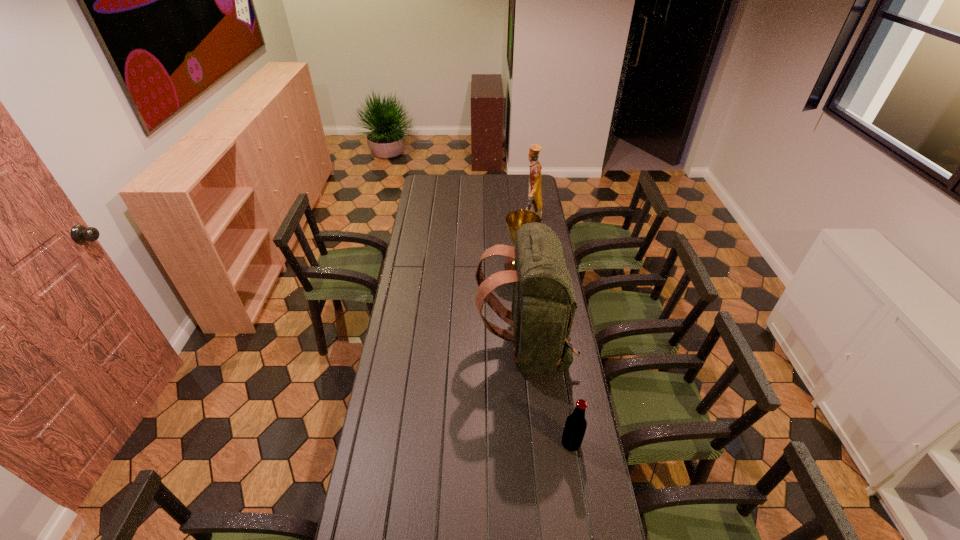
Identify the location of the second nearest object. The image size is (960, 540). (543, 307).

Where is `the tallest object`? This screenshot has width=960, height=540. the tallest object is located at coordinates (543, 307).

Identify the location of the second tallest object. This screenshot has width=960, height=540. (535, 203).

Locate an element on the screen. This screenshot has width=960, height=540. nutcracker is located at coordinates (535, 203).

The image size is (960, 540). I want to click on award, so click(515, 219).

Locate an element on the screen. Image resolution: width=960 pixels, height=540 pixels. the third nearest object is located at coordinates (515, 219).

You are a GUI agent. You are given a task and a screenshot of the screen. Output one action in this format:
    pyautogui.click(x=<x>, y=<y>)
    Task: Click on the nearest object
    The height and width of the screenshot is (540, 960).
    Given the screenshot: What is the action you would take?
    pyautogui.click(x=575, y=426)

Where is `the shortest object`? the shortest object is located at coordinates (575, 426).

Image resolution: width=960 pixels, height=540 pixels. In order to click on free location located on the back of the third farthest object in this screenshot , I will do `click(439, 348)`.

The image size is (960, 540). I want to click on blank area located 0.070m on the back of the third farthest object, so [x=459, y=348].